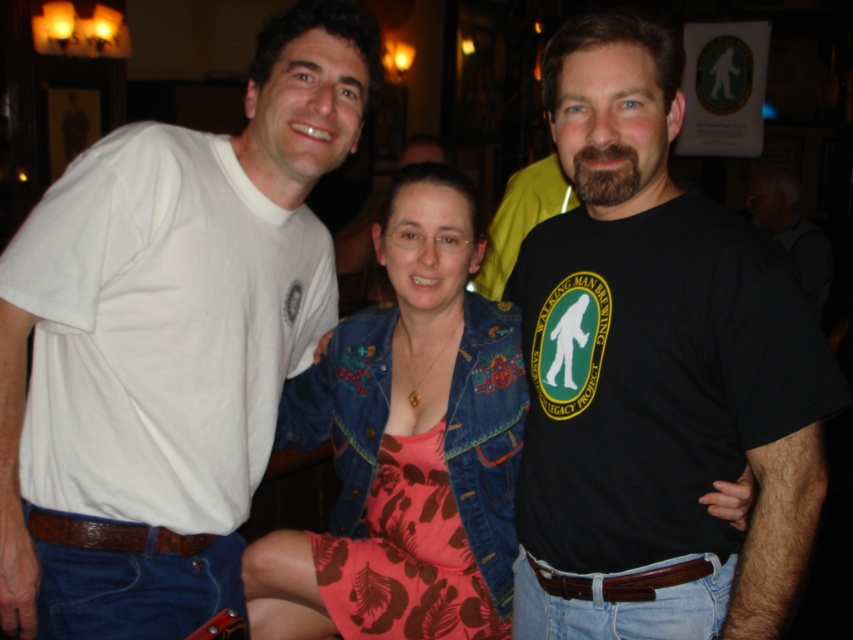
Question: Which point is closer to the camera?

Choices:
 (A) denim jacket at center
 (B) black cotton t-shirt at center
 (C) brown leather belt at lower center

Answer: (B)

Question: In this image, where is black cotton t-shirt at center located relative to brown leather belt at lower center?

Choices:
 (A) below
 (B) above

Answer: (B)

Question: Is white t-shirt at left closer to camera compared to brown leather belt at lower left?

Choices:
 (A) no
 (B) yes

Answer: (B)

Question: Which point is closer to the camera?

Choices:
 (A) (96, 524)
 (B) (368, 496)
 (C) (152, 467)
 (D) (692, 500)

Answer: (D)

Question: Which point appears closest to the camera in this image?

Choices:
 (A) (409, 561)
 (B) (178, 554)
 (C) (392, 529)
 (D) (614, 579)

Answer: (D)

Question: Does white t-shirt at left have a smaller size compared to brown leather belt at lower center?

Choices:
 (A) no
 (B) yes

Answer: (A)